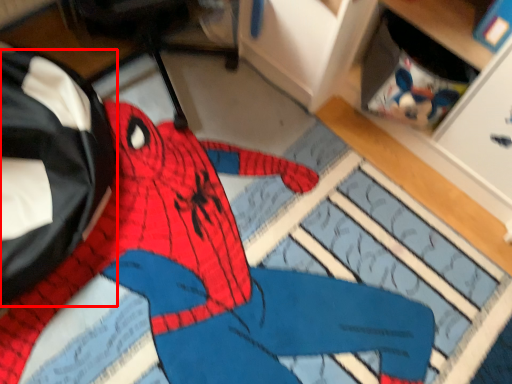
Question: Considering the relative positions of messenger bag (annotated by the red box) and person in the image provided, where is messenger bag (annotated by the red box) located with respect to the staircase?

Choices:
 (A) left
 (B) right

Answer: (A)